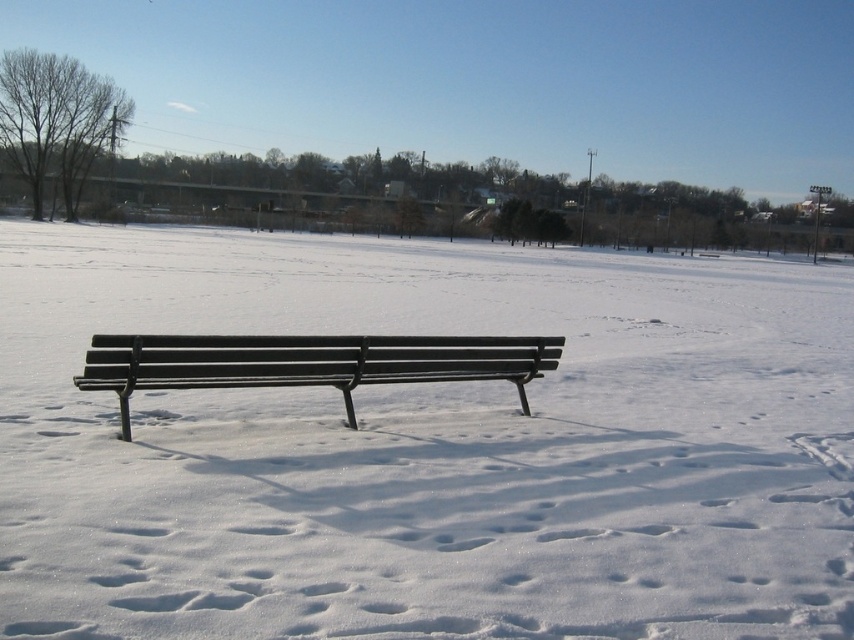
Consider the image. Between white matte bench at center and matte black bench at center, which one is positioned lower?

matte black bench at center

Is white matte bench at center above matte black bench at center?

Correct, white matte bench at center is located above matte black bench at center.

The width and height of the screenshot is (854, 640). What do you see at coordinates (427, 445) in the screenshot?
I see `white matte bench at center` at bounding box center [427, 445].

Locate an element on the screen. The image size is (854, 640). white matte bench at center is located at coordinates (427, 445).